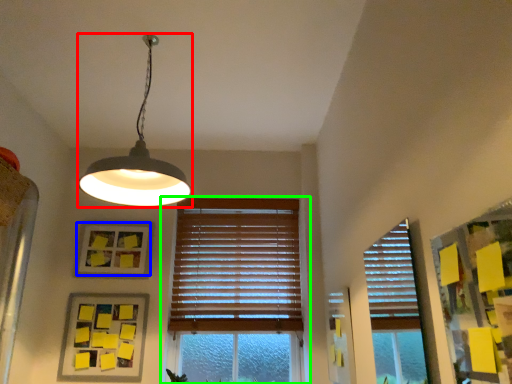
Question: Estimate the real-world distances between objects in this image. Which object is closer to lamp (highlighted by a red box), picture frame (highlighted by a blue box) or window (highlighted by a green box)?

Choices:
 (A) picture frame
 (B) window

Answer: (A)